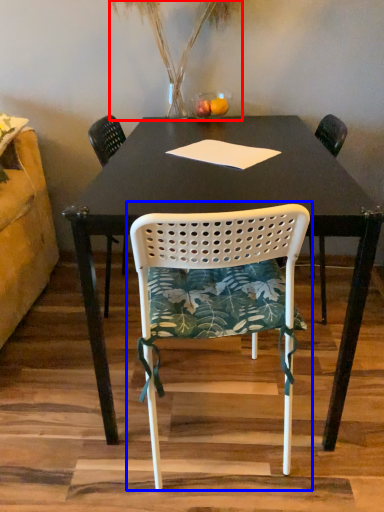
Question: Which of the following is the closest to the observer, plant (highlighted by a red box) or chair (highlighted by a blue box)?

Choices:
 (A) plant
 (B) chair

Answer: (B)